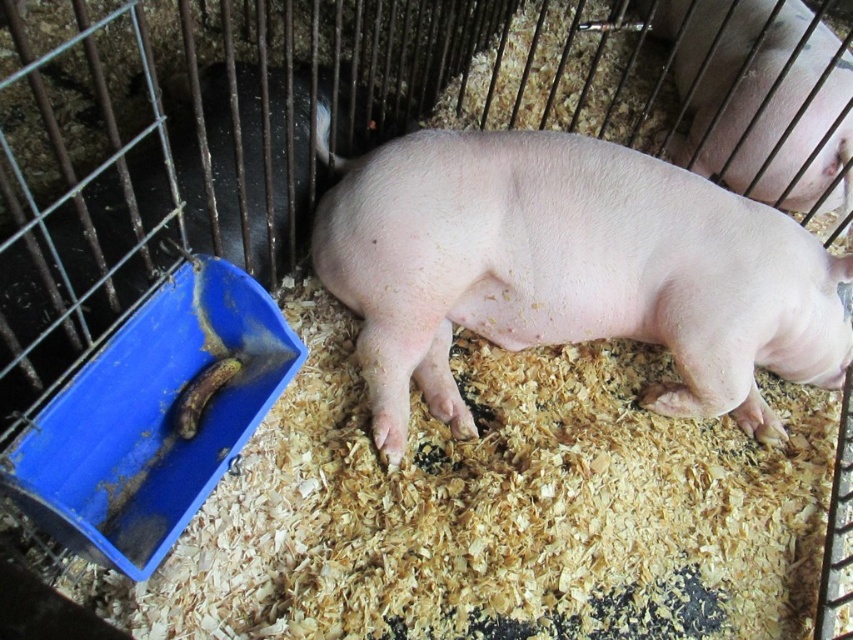
Which is below, pink smooth pig at center or pink smooth skin at center?

pink smooth pig at center

Can you confirm if pink smooth pig at center is shorter than pink smooth skin at center?

Yes.

Measure the distance between pink smooth pig at center and camera.

The distance of pink smooth pig at center from camera is 1.61 meters.

Where is `pink smooth pig at center`? This screenshot has width=853, height=640. pink smooth pig at center is located at coordinates (572, 272).